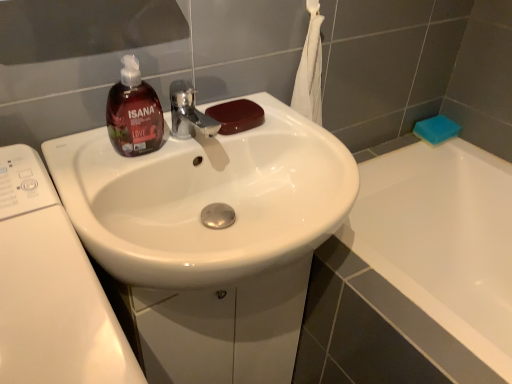
Question: From a real-world perspective, is white glossy sink at center positioned above or below brown glossy soap at sink, marked as the second soap in a back-to-front arrangement?

Choices:
 (A) above
 (B) below

Answer: (B)

Question: Is white glossy sink at center bigger or smaller than brown glossy soap at sink, which is the 1th soap in front-to-back order?

Choices:
 (A) small
 (B) big

Answer: (B)

Question: Considering the real-world distances, which object is farthest from the brown glossy soap at sink, which is the 1th soap in front-to-back order?

Choices:
 (A) blue sponge at upper right, placed as the 1th soap when sorted from back to front
 (B) white glossy sink at center
 (C) white glossy washing machine at left
 (D) brown matte liquid soap at upper left

Answer: (A)

Question: Which is farther from the brown glossy soap at sink, placed as the first soap when sorted from left to right?

Choices:
 (A) white glossy washing machine at left
 (B) brown matte liquid soap at upper left
 (C) white glossy sink at center
 (D) blue sponge at upper right, placed as the 1th soap when sorted from back to front

Answer: (D)